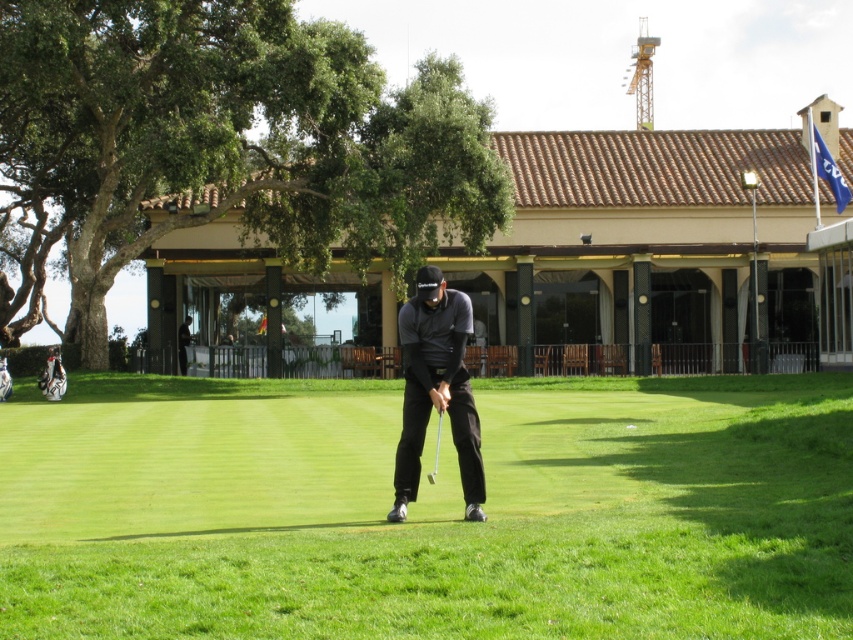
You are a golfer who wants to ensure your equipment fits on the green. Given the green grass at center and the black matte golf club at center, which one has a greater width?

The green grass at center has a greater width than the black matte golf club at center according to the description.

You are a golfer standing at the tee and want to hit the ball to the green. The green grass at center is located at point (428, 512). What is the coordinate of the green grass at center?

The green grass at center is located at point (428, 512).